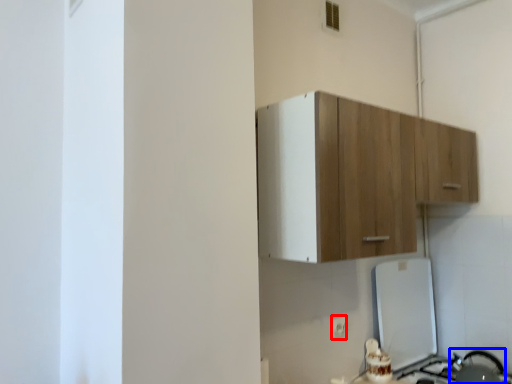
Question: Among these objects, which one is nearest to the camera, electric outlet (highlighted by a red box) or appliance (highlighted by a blue box)?

Choices:
 (A) electric outlet
 (B) appliance

Answer: (B)